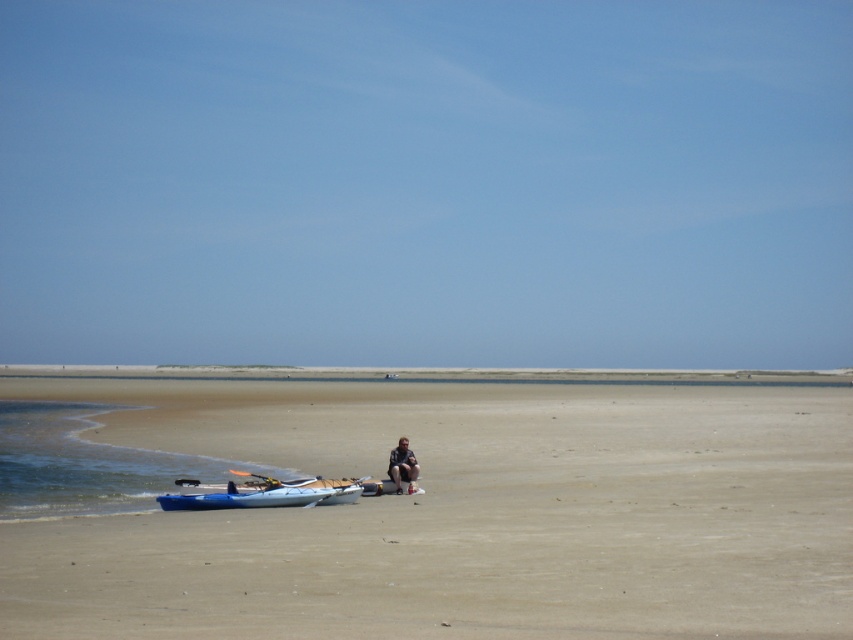
Is beige sand at center smaller than dark gray fabric pants at center?

Actually, beige sand at center might be larger than dark gray fabric pants at center.

Is beige sand at center to the left of dark gray fabric pants at center from the viewer's perspective?

Correct, you'll find beige sand at center to the left of dark gray fabric pants at center.

Who is more forward, (363, 620) or (410, 464)?

Point (363, 620) is in front.

Where is `beige sand at center`? This screenshot has height=640, width=853. beige sand at center is located at coordinates (462, 515).

In order to click on beige sand at center in this screenshot , I will do `click(462, 515)`.

Can you confirm if beige sand at center is taller than blue plastic kayak at lower left?

Yes, beige sand at center is taller than blue plastic kayak at lower left.

I want to click on beige sand at center, so click(x=462, y=515).

Between blue plastic kayak at lower left and dark gray fabric pants at center, which one is positioned higher?

dark gray fabric pants at center is above.

The image size is (853, 640). What are the coordinates of `blue plastic kayak at lower left` in the screenshot? It's located at (260, 492).